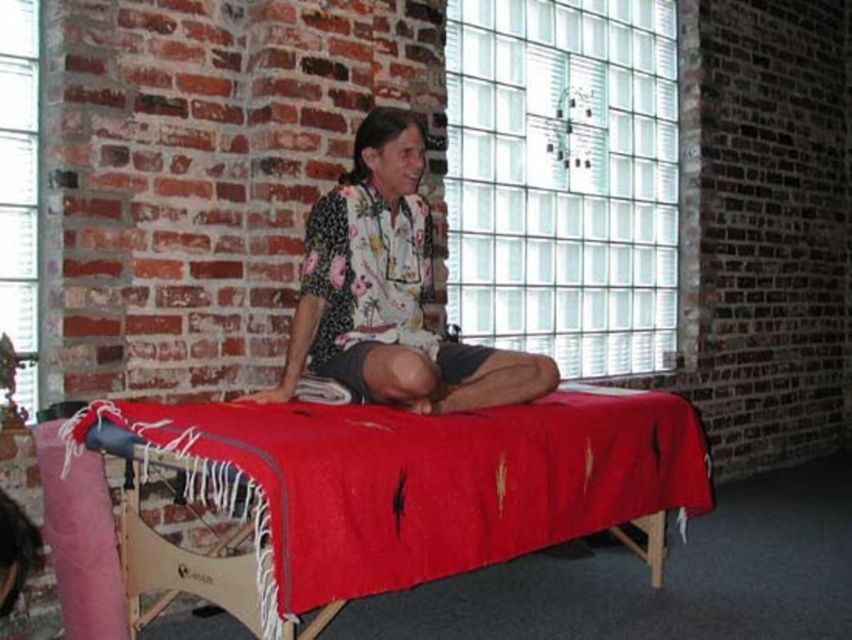
You are a photographer setting up for a photoshoot. You have a camera with a 12 inch lens. You need to position yourself so that the red woven blanket at center and the floral fabric shirt at center are both in focus. Can you stand close enough to capture both objects clearly without moving the camera?

The distance between the red woven blanket at center and the floral fabric shirt at center is 15.69 inches. Since your camera lens has a 12 inch focus range, you cannot stand close enough to capture both objects clearly without moving the camera because the distance exceeds the lens capability.

You are a photographer setting up a shoot in this room. You want to place a small lamp on the floor near the red woven blanket at center to highlight it. Based on the coordinates provided, where should you position the lamp relative to the blanket?

The red woven blanket at center is located at point (417, 481), so you should position the lamp close to these coordinates to ensure it is near the blanket.